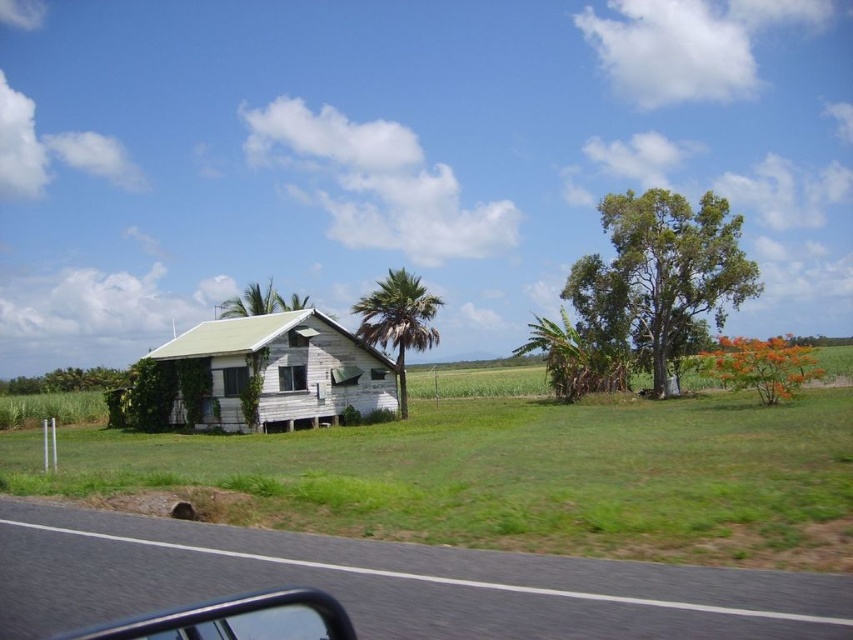
Can you confirm if black asphalt road at lower left is positioned above green leafy palm tree at center?

No, black asphalt road at lower left is not above green leafy palm tree at center.

At what (x,y) coordinates should I click in order to perform the action: click on black asphalt road at lower left. Please return your answer as a coordinate pair (x, y). The width and height of the screenshot is (853, 640). Looking at the image, I should click on (392, 582).

Identify the location of black asphalt road at lower left. The width and height of the screenshot is (853, 640). (392, 582).

Is weathered wood house at left above clear glass window at lower center?

Incorrect, weathered wood house at left is not positioned above clear glass window at lower center.

Which is in front, point (614, 525) or point (199, 611)?

Point (199, 611)

The image size is (853, 640). Find the location of `weathered wood house at left`. weathered wood house at left is located at coordinates (514, 476).

What do you see at coordinates (514, 476) in the screenshot? Image resolution: width=853 pixels, height=640 pixels. I see `weathered wood house at left` at bounding box center [514, 476].

Is weathered wood house at left below transparent glass car window at lower left?

Indeed, weathered wood house at left is positioned under transparent glass car window at lower left.

Between point (836, 472) and point (236, 372), which one is positioned in front?

Positioned in front is point (836, 472).

Identify the location of weathered wood house at left. The height and width of the screenshot is (640, 853). (514, 476).